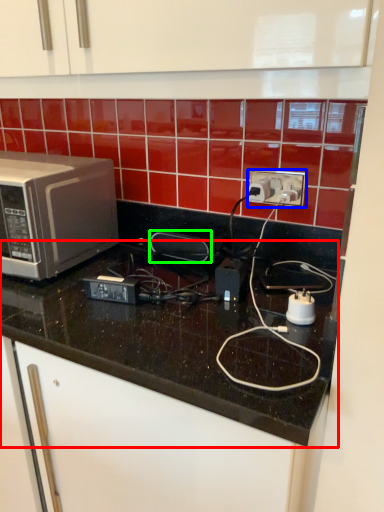
Question: Estimate the real-world distances between objects in this image. Which object is closer to countertop (highlighted by a red box), power plugs and sockets (highlighted by a blue box) or appliance (highlighted by a green box)?

Choices:
 (A) power plugs and sockets
 (B) appliance

Answer: (B)